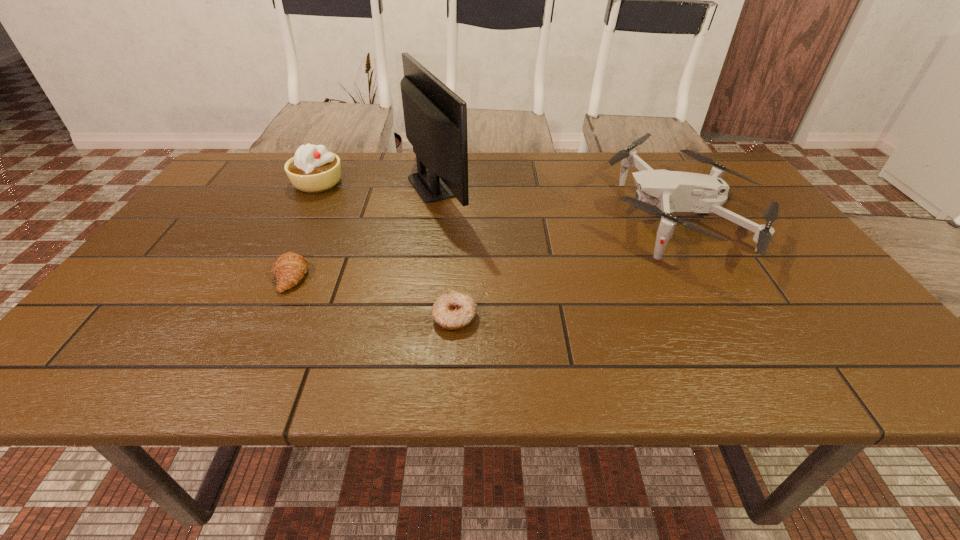
Find the location of a particular element. The image size is (960, 540). the tallest object is located at coordinates (435, 118).

Identify the location of drone. The width and height of the screenshot is (960, 540). (660, 192).

At what (x,y) coordinates should I click in order to perform the action: click on whipped cream. Please return your answer as a coordinate pair (x, y). Looking at the image, I should click on (313, 169).

Locate an element on the screen. This screenshot has width=960, height=540. the fourth tallest object is located at coordinates (289, 268).

At what (x,y) coordinates should I click in order to perform the action: click on doughnut. Please return your answer as a coordinate pair (x, y). Image resolution: width=960 pixels, height=540 pixels. Looking at the image, I should click on (455, 309).

Find the location of a particular element. The width and height of the screenshot is (960, 540). the nearest object is located at coordinates (455, 309).

This screenshot has height=540, width=960. Find the location of `free space located on the front-facing side of the computer monitor`. free space located on the front-facing side of the computer monitor is located at coordinates (594, 185).

Locate an element on the screen. This screenshot has width=960, height=540. vacant area situated with a camera at the front of the rightmost object is located at coordinates (520, 216).

This screenshot has height=540, width=960. I want to click on vacant space situated with a camera at the front of the rightmost object, so pos(558,216).

Locate an element on the screen. vacant region located 0.050m with a camera at the front of the rightmost object is located at coordinates (584, 216).